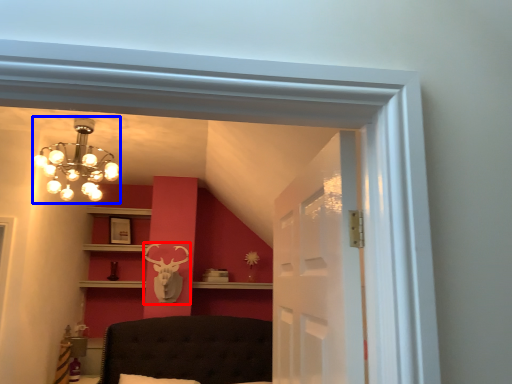
Question: Among these objects, which one is farthest to the camera, deer (highlighted by a red box) or lamp (highlighted by a blue box)?

Choices:
 (A) deer
 (B) lamp

Answer: (A)